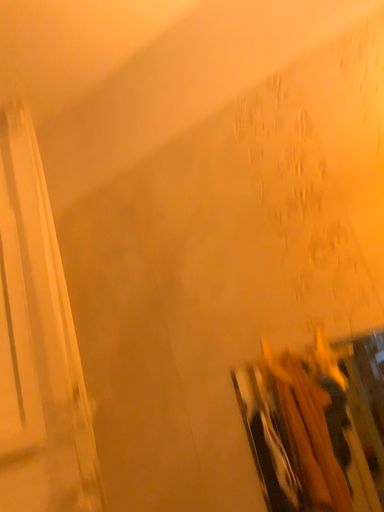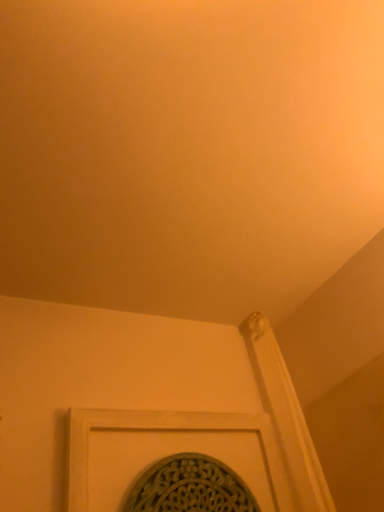
Question: How did the camera likely rotate when shooting the video?

Choices:
 (A) rotated upward
 (B) rotated downward

Answer: (A)